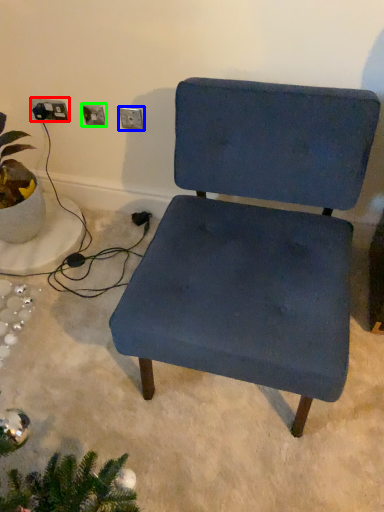
Question: Which is farther away from electric outlet (highlighted by a red box)? electric outlet (highlighted by a blue box) or electric outlet (highlighted by a green box)?

Choices:
 (A) electric outlet
 (B) electric outlet

Answer: (A)